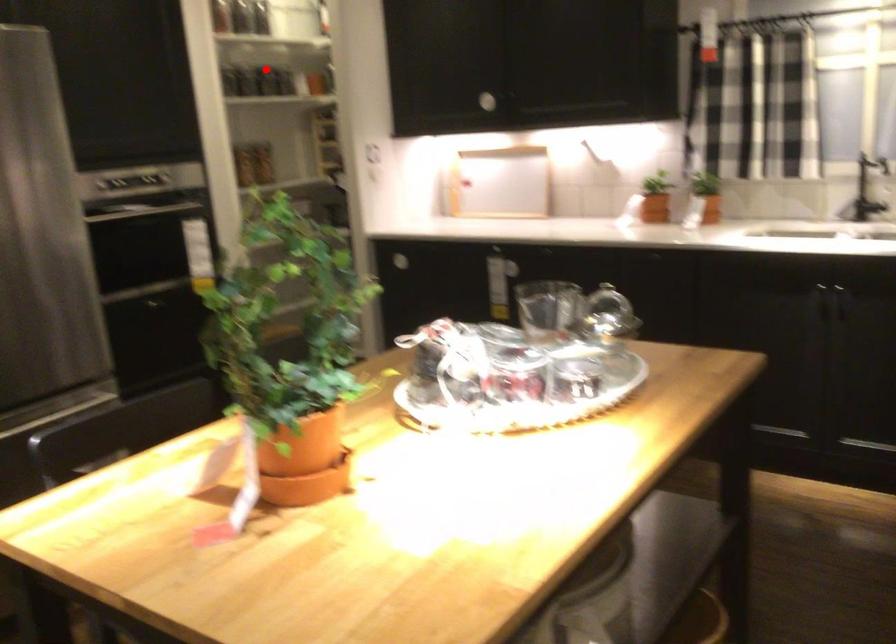
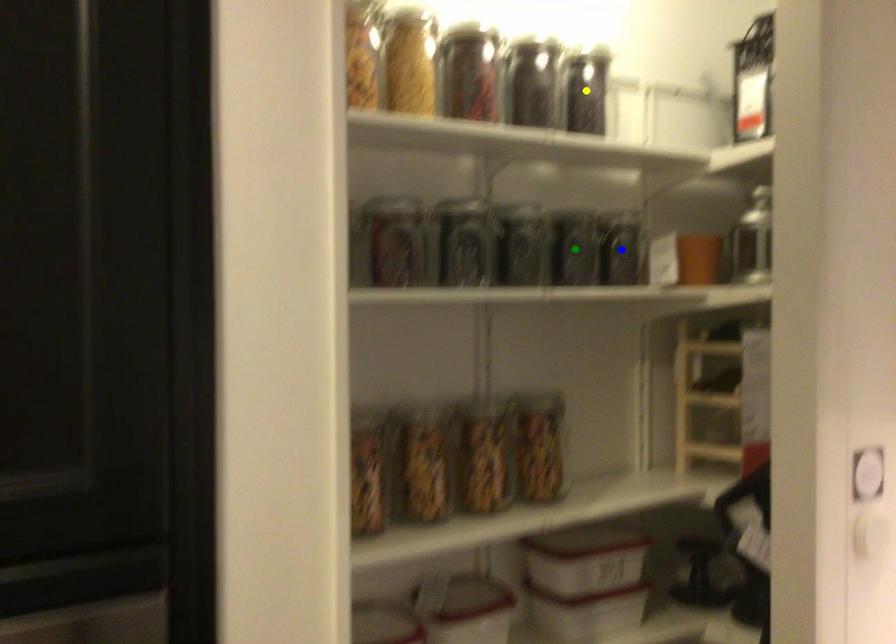
Question: I am providing you with two images of the same scene from different viewpoints. A red point is marked on the first image. You are given multiple points on the second image. Which mark in image 2 goes with the point in image 1?

Choices:
 (A) blue point
 (B) yellow point
 (C) green point

Answer: (C)